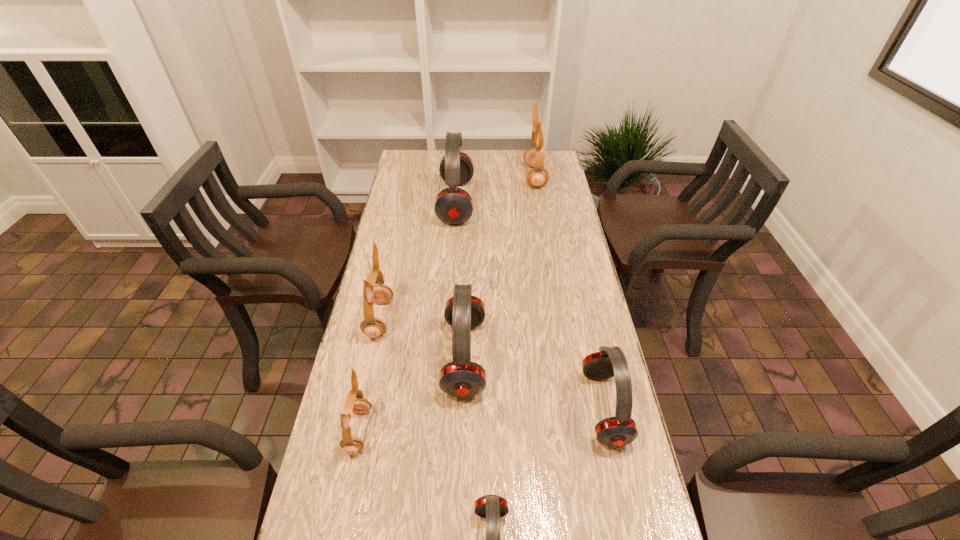
In the image, there is a desktop. At what (x,y) coordinates should I click in order to perform the action: click on vacant space at the left edge. Please return your answer as a coordinate pair (x, y). Looking at the image, I should click on click(x=408, y=280).

This screenshot has width=960, height=540. In order to click on vacant position at the right edge of the desktop in this screenshot , I will do `click(561, 250)`.

What are the coordinates of `vacant space at the far right corner of the desktop` in the screenshot? It's located at (552, 166).

Locate an element on the screen. vacant area between the second smallest brown earphone and the rightmost red earphone is located at coordinates (492, 363).

Where is `vacant area that lies between the second smallest brown earphone and the second biggest red earphone`? vacant area that lies between the second smallest brown earphone and the second biggest red earphone is located at coordinates (421, 338).

You are a GUI agent. You are given a task and a screenshot of the screen. Output one action in this format:
    pyautogui.click(x=<x>, y=<y>)
    Task: Click on the vacant area that lies between the rightmost brown earphone and the biggest red earphone
    
    Given the screenshot: What is the action you would take?
    pyautogui.click(x=495, y=190)

Where is `free space between the rightmost brown earphone and the third smallest red earphone`? free space between the rightmost brown earphone and the third smallest red earphone is located at coordinates (500, 267).

The image size is (960, 540). I want to click on object identified as the sixth closest to the shortest earphone, so click(537, 177).

Locate which object ranks in proximity to the biggest brown earphone. Please provide its 2D coordinates. Your answer should be formatted as a tuple, i.e. [(x, y)], where the tuple contains the x and y coordinates of a point satisfying the conditions above.

[(453, 205)]

Locate an element on the screen. The image size is (960, 540). earphone that stands as the third closest to the biggest red earphone is located at coordinates (461, 378).